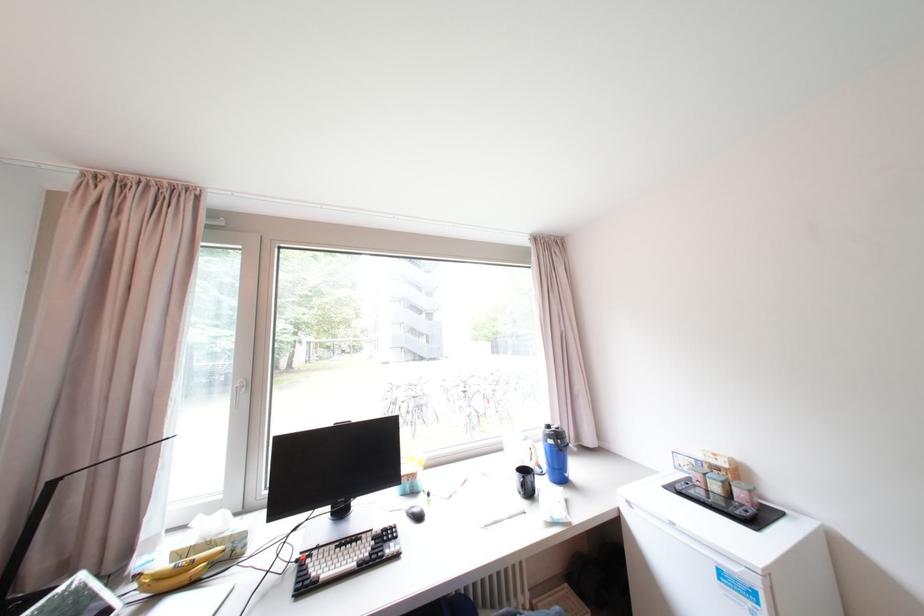
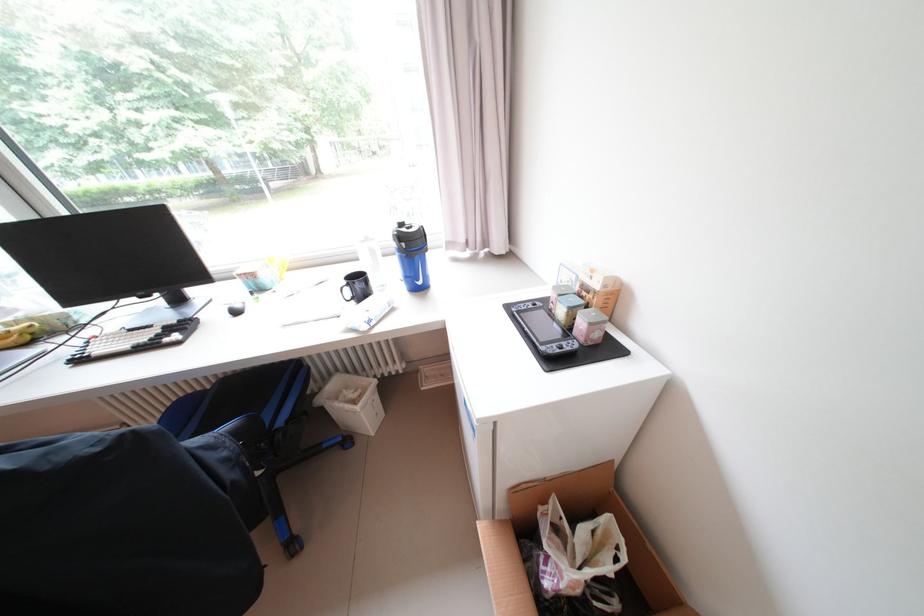
In the second image, find the point that corresponds to (x=751, y=496) in the first image.

(590, 329)